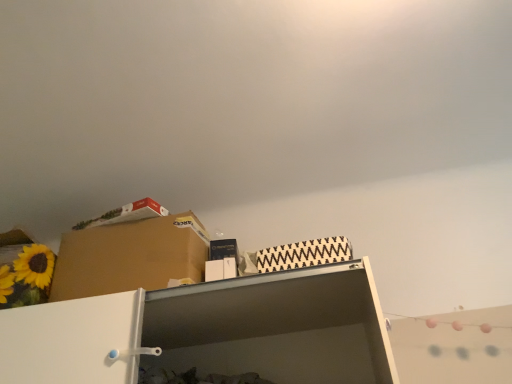
Describe the element at coordinates (130, 257) in the screenshot. This screenshot has height=384, width=512. I see `brown cardboard box at upper left` at that location.

Where is `brown cardboard box at upper left`? This screenshot has height=384, width=512. brown cardboard box at upper left is located at coordinates (130, 257).

The height and width of the screenshot is (384, 512). What do you see at coordinates (209, 332) in the screenshot? I see `white matte shelf at upper center` at bounding box center [209, 332].

Locate an element on the screen. white matte shelf at upper center is located at coordinates (209, 332).

From the picture: Measure the distance between point (x=71, y=357) and camera.

Point (x=71, y=357) and camera are 1.22 meters apart from each other.

This screenshot has width=512, height=384. Find the location of `brown cardboard box at upper left`. brown cardboard box at upper left is located at coordinates (130, 257).

Which object is positioned more to the left, brown cardboard box at upper left or white matte shelf at upper center?

brown cardboard box at upper left is more to the left.

Which object is further away from the camera taking this photo, brown cardboard box at upper left or white matte shelf at upper center?

brown cardboard box at upper left is further away from the camera.

Is point (197, 218) more distant than point (145, 313)?

Yes, it is behind point (145, 313).

From the image's perspective, would you say brown cardboard box at upper left is shown under white matte shelf at upper center?

Incorrect, from the image's perspective, brown cardboard box at upper left is higher than white matte shelf at upper center.

From a real-world perspective, is brown cardboard box at upper left positioned under white matte shelf at upper center based on gravity?

No, from a real-world perspective, brown cardboard box at upper left is not under white matte shelf at upper center.

Does brown cardboard box at upper left have a lesser width compared to white matte shelf at upper center?

Yes.

Is brown cardboard box at upper left taller or shorter than white matte shelf at upper center?

brown cardboard box at upper left is taller than white matte shelf at upper center.

Between brown cardboard box at upper left and white matte shelf at upper center, which one has smaller size?

Smaller between the two is white matte shelf at upper center.

Is white matte shelf at upper center surrounded by brown cardboard box at upper left?

That's incorrect, white matte shelf at upper center is not inside brown cardboard box at upper left.

Is brown cardboard box at upper left directly adjacent to white matte shelf at upper center?

No, brown cardboard box at upper left is not in contact with white matte shelf at upper center.

Is brown cardboard box at upper left looking in the opposite direction of white matte shelf at upper center?

No, white matte shelf at upper center is not at the back of brown cardboard box at upper left.

What's the angular difference between brown cardboard box at upper left and white matte shelf at upper center's facing directions?

4.75e-05 degrees separate the facing orientations of brown cardboard box at upper left and white matte shelf at upper center.

Locate an element on the screen. This screenshot has width=512, height=384. shelf beneath the brown cardboard box at upper left (from a real-world perspective) is located at coordinates (209, 332).

Is white matte shelf at upper center at the left side of brown cardboard box at upper left?

No.

Considering their positions, is white matte shelf at upper center located in front of or behind brown cardboard box at upper left?

Clearly, white matte shelf at upper center is in front of brown cardboard box at upper left.

Considering the positions of point (333, 347) and point (140, 255), is point (333, 347) closer or farther from the camera than point (140, 255)?

Point (333, 347) appears to be farther away from the viewer than point (140, 255).

From the image's perspective, which one is positioned higher, white matte shelf at upper center or brown cardboard box at upper left?

brown cardboard box at upper left, from the image's perspective.

From a real-world perspective, which object rests below the other?

white matte shelf at upper center is physically lower.

Can you confirm if white matte shelf at upper center is thinner than brown cardboard box at upper left?

No.

Which of these two, white matte shelf at upper center or brown cardboard box at upper left, stands shorter?

Standing shorter between the two is white matte shelf at upper center.

In the scene shown: Can you confirm if white matte shelf at upper center is smaller than brown cardboard box at upper left?

Yes, white matte shelf at upper center is smaller than brown cardboard box at upper left.

Is brown cardboard box at upper left located within white matte shelf at upper center?

That's incorrect, brown cardboard box at upper left is not inside white matte shelf at upper center.

Would you consider white matte shelf at upper center to be distant from brown cardboard box at upper left?

A: Actually, white matte shelf at upper center and brown cardboard box at upper left are a little close together.

Is brown cardboard box at upper left at the back of white matte shelf at upper center?

No, brown cardboard box at upper left is not at the back of white matte shelf at upper center.

Measure the distance between white matte shelf at upper center and brown cardboard box at upper left.

white matte shelf at upper center is 13.12 inches away from brown cardboard box at upper left.

Where is `shelf below the brown cardboard box at upper left (from the image's perspective)`? The width and height of the screenshot is (512, 384). shelf below the brown cardboard box at upper left (from the image's perspective) is located at coordinates (x=209, y=332).

This screenshot has width=512, height=384. In the image, there is a white matte shelf at upper center. In order to click on cardboard box above it (from the image's perspective) in this screenshot , I will do 130,257.

Find the location of a particular element. This screenshot has height=384, width=512. cardboard box above the white matte shelf at upper center (from a real-world perspective) is located at coordinates (130, 257).